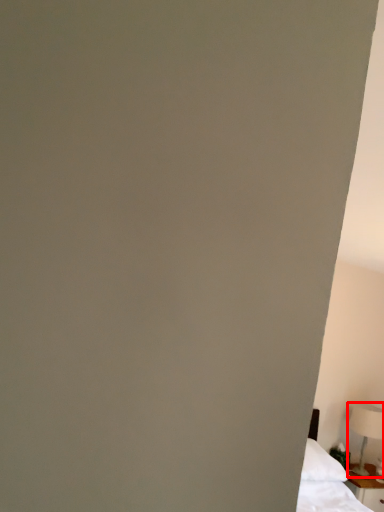
Question: In this image, where is table lamp (annotated by the red box) located relative to nightstand?

Choices:
 (A) right
 (B) left

Answer: (A)